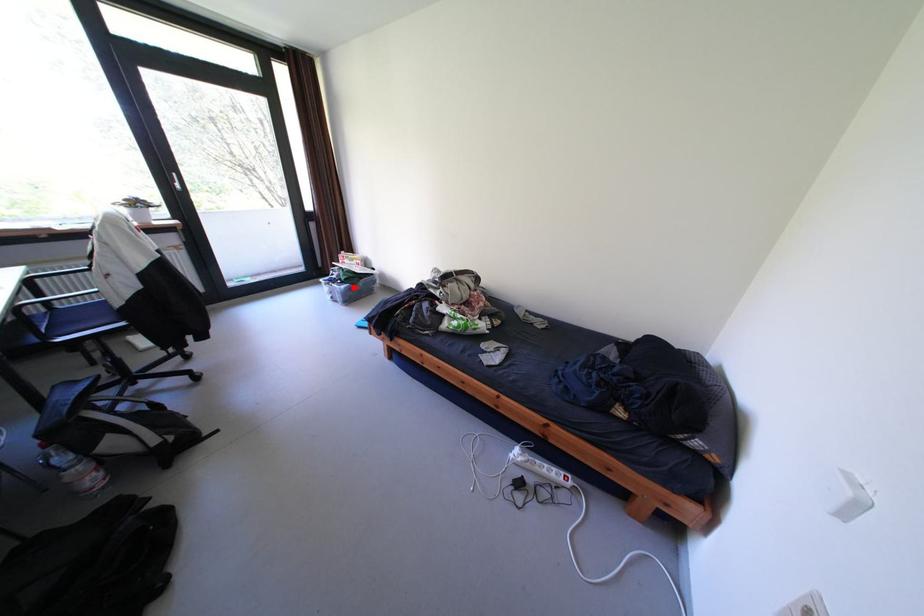
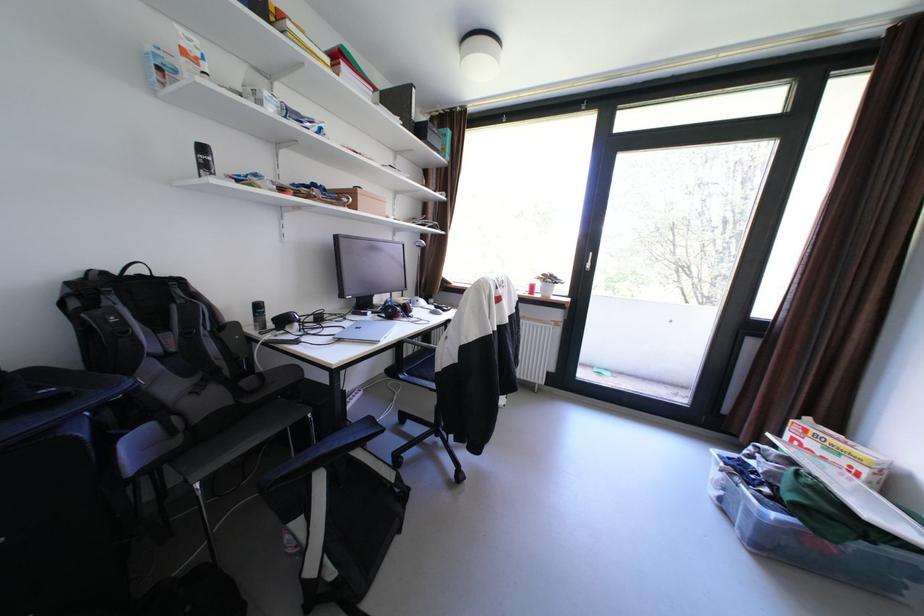
The point at the highlighted location is marked in the first image. Where is the corresponding point in the second image?

(784, 516)